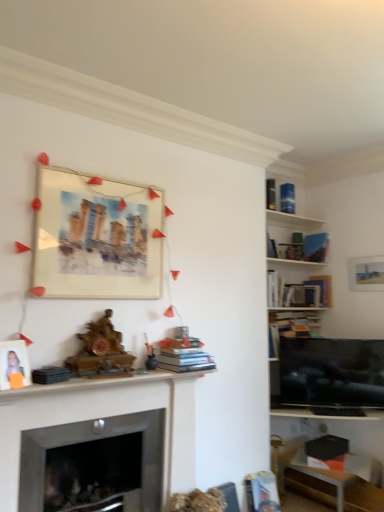
Question: Looking at their shapes, would you say hardcover books at center, the first book in the left-to-right sequence, is wider or thinner than hardcover book at upper right, which ranks as the 3th book in left-to-right order?

Choices:
 (A) wide
 (B) thin

Answer: (A)

Question: From the image's perspective, is hardcover books at center, which is counted as the second book, starting from the bottom, positioned above or below hardcover book at upper right, the 4th book viewed from the right?

Choices:
 (A) above
 (B) below

Answer: (B)

Question: Which is nearer to the hardcover book at upper right, which is the 4th book from back to front?

Choices:
 (A) matte white photo frame at left, the first picture frame viewed from the front
 (B) white wooden shelf at upper right
 (C) hardcover books at center, positioned as the 6th book in back-to-front order
 (D) hardcover book at center-right, which is the 4th book from front to back
 (E) blue matte bookshelf at upper right, which ranks as the 6th book in left-to-right order

Answer: (B)

Question: Considering the real-world distances, which object is farthest from the hardcover book at center-right, the 5th book positioned from the left?

Choices:
 (A) white wooden shelf at upper right
 (B) matte white photo frame at left, arranged as the 1th picture frame when viewed from the left
 (C) wooden mantelpiece at center
 (D) hardcover book at lower right, arranged as the 1th book when ordered from the bottom
 (E) hardcover books at center, arranged as the first book when viewed from the front

Answer: (B)